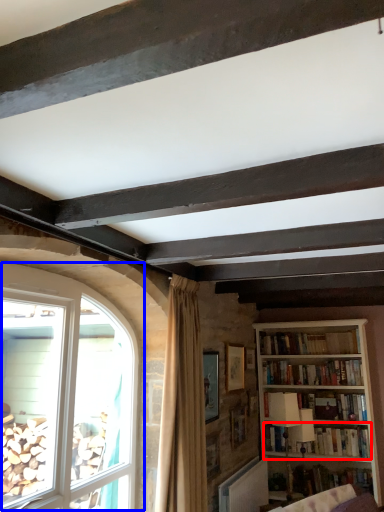
Question: Which point is closer to the camera, book (highlighted by a red box) or window (highlighted by a blue box)?

Choices:
 (A) book
 (B) window

Answer: (B)